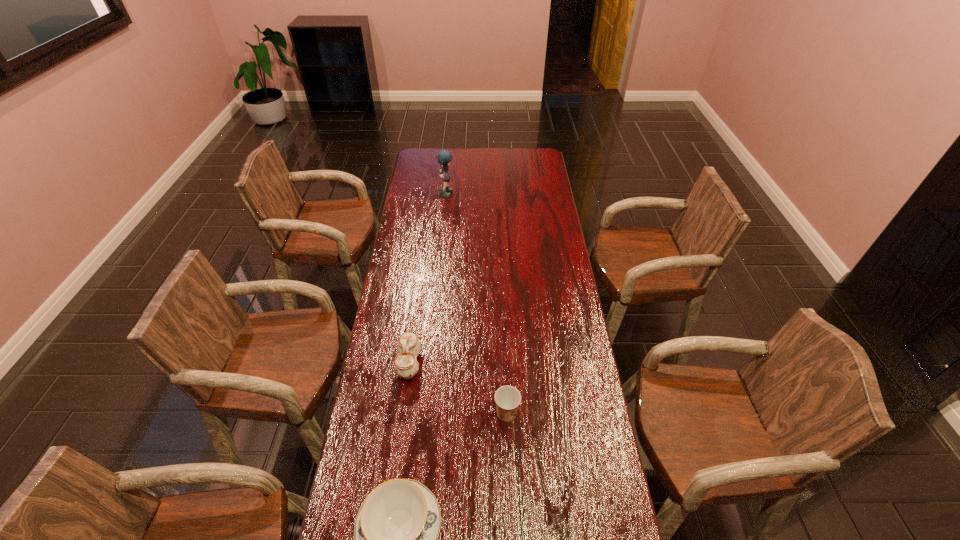
Identify the location of free space at the left edge of the desktop. (421, 234).

In the image, there is a desktop. At what (x,y) coordinates should I click in order to perform the action: click on vacant space at the right edge. Please return your answer as a coordinate pair (x, y). Looking at the image, I should click on (540, 357).

The height and width of the screenshot is (540, 960). What are the coordinates of `vacant region at the far right corner of the desktop` in the screenshot? It's located at (542, 159).

Where is `vacant area between the farther chinaware and the rag doll`? vacant area between the farther chinaware and the rag doll is located at coordinates (428, 278).

Where is `vacant area that lies between the farther chinaware and the second nearest object`? The height and width of the screenshot is (540, 960). vacant area that lies between the farther chinaware and the second nearest object is located at coordinates (x=458, y=388).

Identify the location of vacant area that lies between the farther chinaware and the third farthest object. (458, 388).

At what (x,y) coordinates should I click in order to perform the action: click on vacant space that's between the second farthest object and the rag doll. Please return your answer as a coordinate pair (x, y). The width and height of the screenshot is (960, 540). Looking at the image, I should click on (428, 278).

At what (x,y) coordinates should I click in order to perform the action: click on free point between the Dixie cup and the second farthest object. Please return your answer as a coordinate pair (x, y). Looking at the image, I should click on (458, 388).

Identify the location of free space that is in between the third nearest object and the rag doll. (428, 278).

At what (x,y) coordinates should I click in order to perform the action: click on vacant space that is in between the rag doll and the third farthest object. Please return your answer as a coordinate pair (x, y). The image size is (960, 540). Looking at the image, I should click on (476, 303).